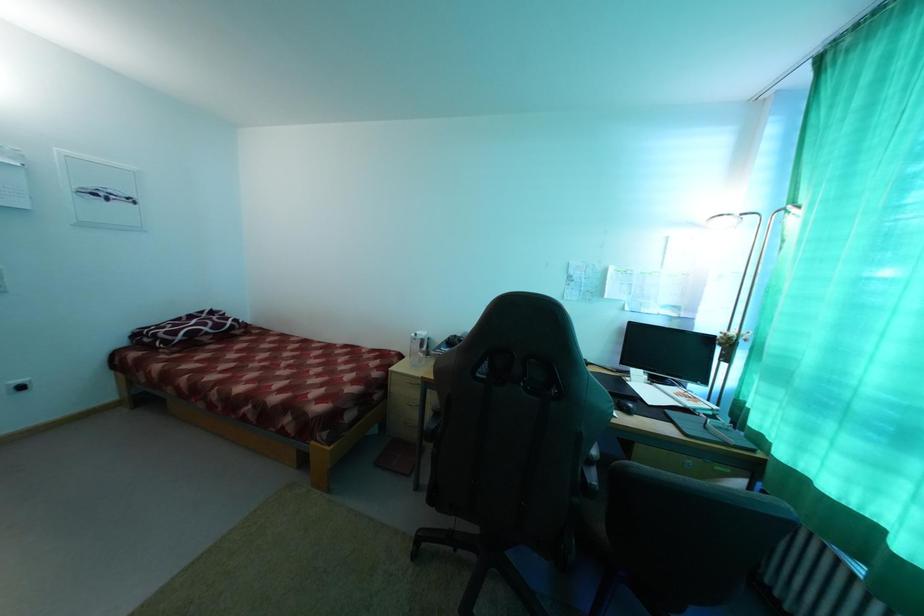
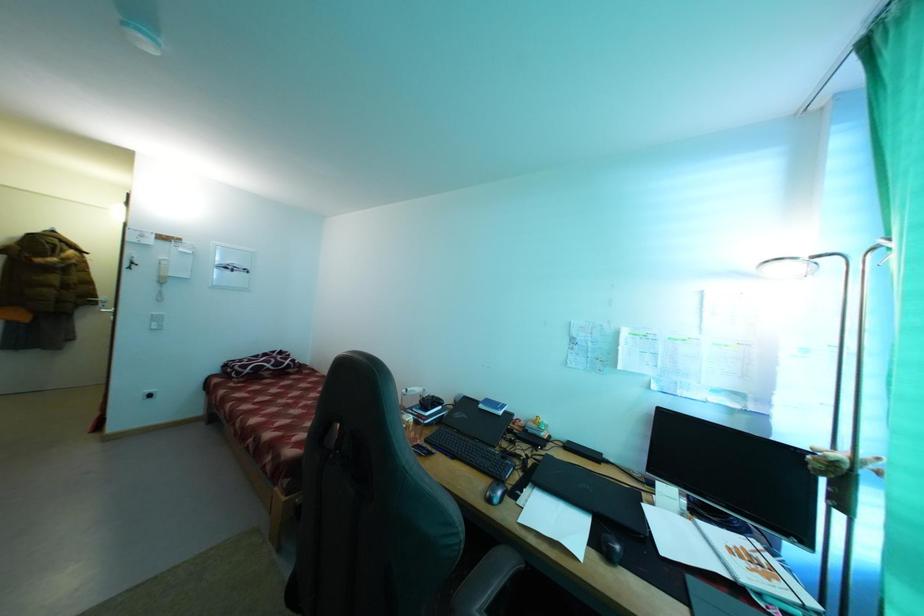
Question: The images are taken continuously from a first-person perspective. In which direction are you moving?

Choices:
 (A) Left
 (B) Right
 (C) Forward
 (D) Backward

Answer: (B)